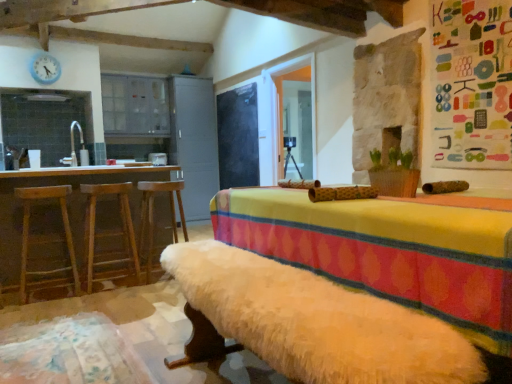
Where is `free spot below wooden bar stool at left, arranged as the second bar stool when viewed from the right (from a real-world perspective)`? The image size is (512, 384). free spot below wooden bar stool at left, arranged as the second bar stool when viewed from the right (from a real-world perspective) is located at coordinates (111, 286).